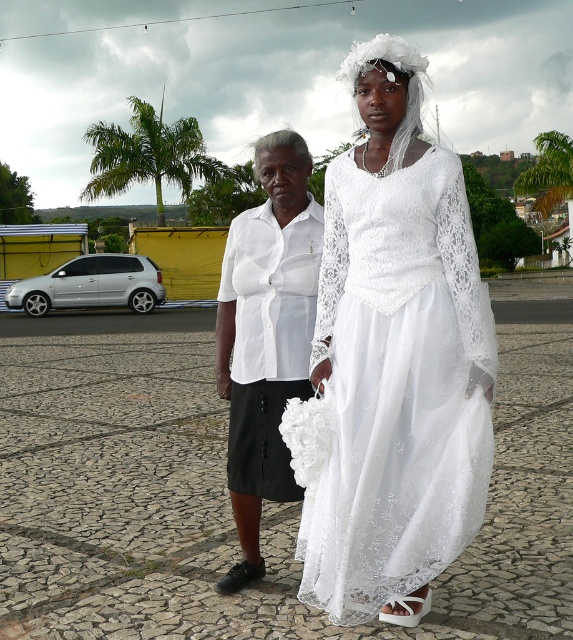
Question: Does white lace dress at center come in front of white cotton blouse at center?

Choices:
 (A) yes
 (B) no

Answer: (A)

Question: Is white lace dress at center further to camera compared to white cotton blouse at center?

Choices:
 (A) yes
 (B) no

Answer: (B)

Question: Observing the image, what is the correct spatial positioning of white lace dress at center in reference to white cotton blouse at center?

Choices:
 (A) above
 (B) below

Answer: (A)

Question: Which point is farther from the camera taking this photo?

Choices:
 (A) (360, 552)
 (B) (270, 180)

Answer: (B)

Question: Which point is farther from the camera taking this photo?

Choices:
 (A) (230, 586)
 (B) (356, 454)

Answer: (A)